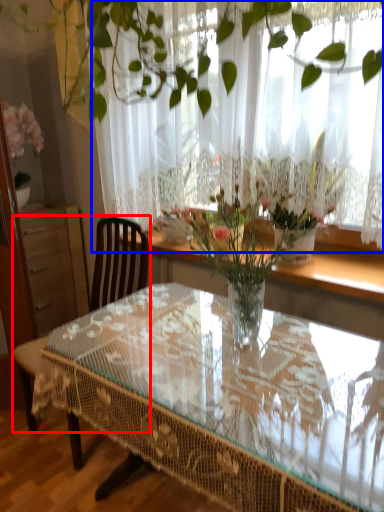
Question: Which object is closer to the camera taking this photo, chair (highlighted by a red box) or curtain (highlighted by a blue box)?

Choices:
 (A) chair
 (B) curtain

Answer: (B)